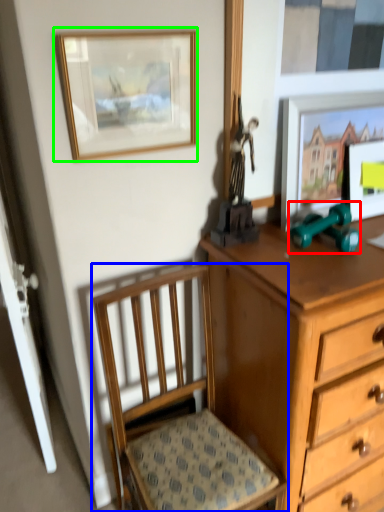
Question: Considering the real-world distances, which object is closest to toy (highlighted by a red box)? chair (highlighted by a blue box) or picture frame (highlighted by a green box).

Choices:
 (A) chair
 (B) picture frame

Answer: (B)